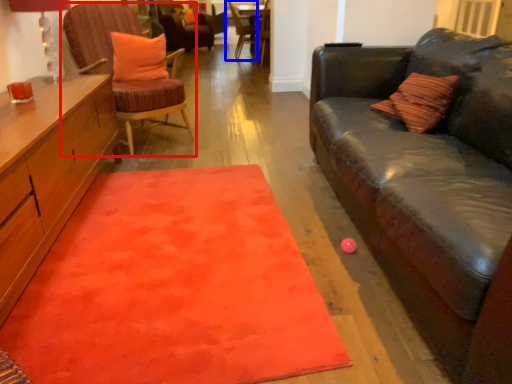
Question: Which of the following is the farthest to the observer, chair (highlighted by a red box) or chair (highlighted by a blue box)?

Choices:
 (A) chair
 (B) chair

Answer: (B)